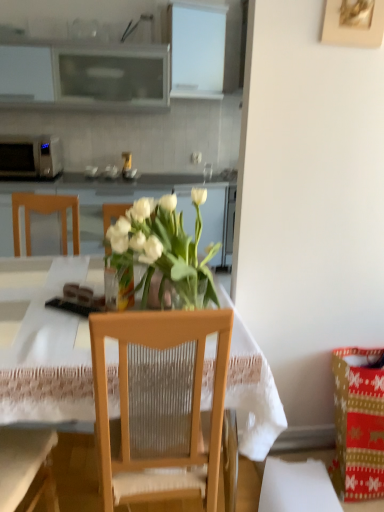
The image size is (384, 512). What are the coordinates of `vacant point to the left of clear glass vase at center` in the screenshot? It's located at (60, 307).